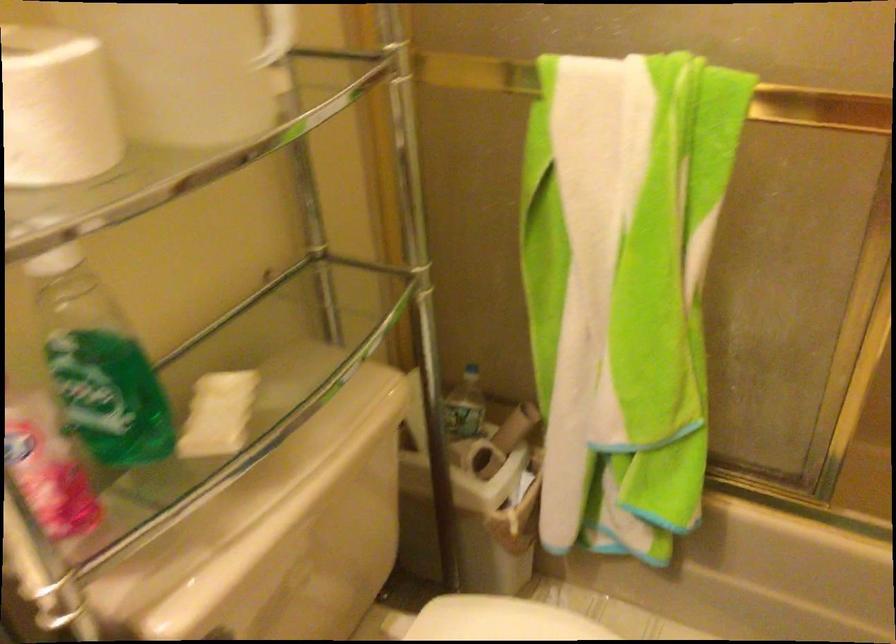
At what (x,y) coordinates should I click in order to perform the action: click on shower door handle. Please return your answer as a coordinate pair (x, y). The width and height of the screenshot is (896, 644). Looking at the image, I should click on (575, 353).